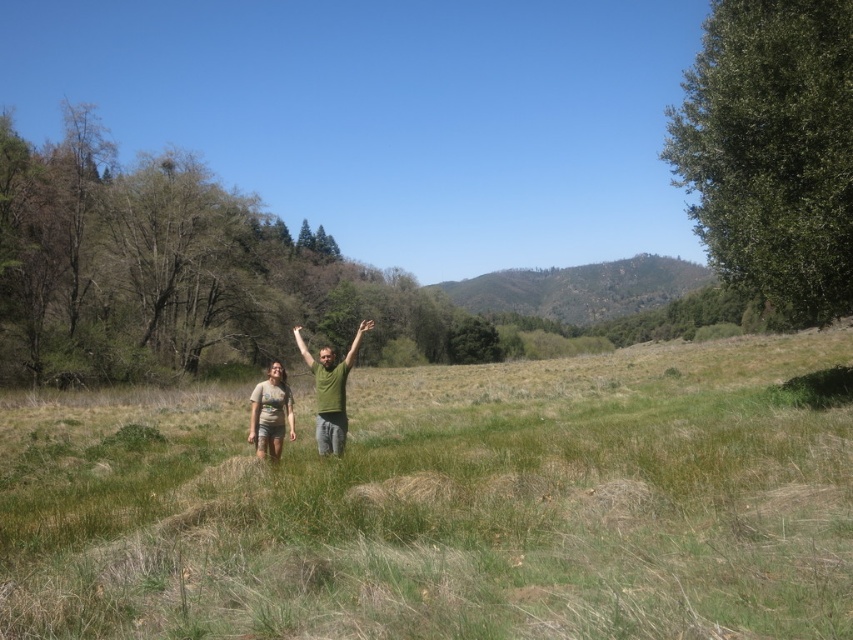
Who is lower down, green grass at center or green leafy tree at right?

Positioned lower is green grass at center.

Which is more to the right, green grass at center or green leafy tree at right?

green leafy tree at right is more to the right.

You are a GUI agent. You are given a task and a screenshot of the screen. Output one action in this format:
    pyautogui.click(x=<x>, y=<y>)
    Task: Click on the green grass at center
    
    Given the screenshot: What is the action you would take?
    pyautogui.click(x=444, y=502)

Is point (169, 417) less distant than point (314, 364)?

No, it is not.

Is green grass at center taller than green matte shirt at center?

Yes.

Between point (631, 408) and point (316, 406), which one is positioned in front?

Positioned in front is point (316, 406).

Image resolution: width=853 pixels, height=640 pixels. I want to click on green grass at center, so click(444, 502).

Is green leafy tree at right taller than matte brown shorts at center?

Yes, green leafy tree at right is taller than matte brown shorts at center.

Is point (810, 76) in front of point (262, 390)?

No, (810, 76) is behind (262, 390).

Does point (788, 285) come behind point (265, 394)?

Yes, point (788, 285) is behind point (265, 394).

You are a GUI agent. You are given a task and a screenshot of the screen. Output one action in this format:
    pyautogui.click(x=<x>, y=<y>)
    Task: Click on the green leafy tree at right
    This screenshot has height=640, width=853.
    Given the screenshot: What is the action you would take?
    pyautogui.click(x=770, y=150)